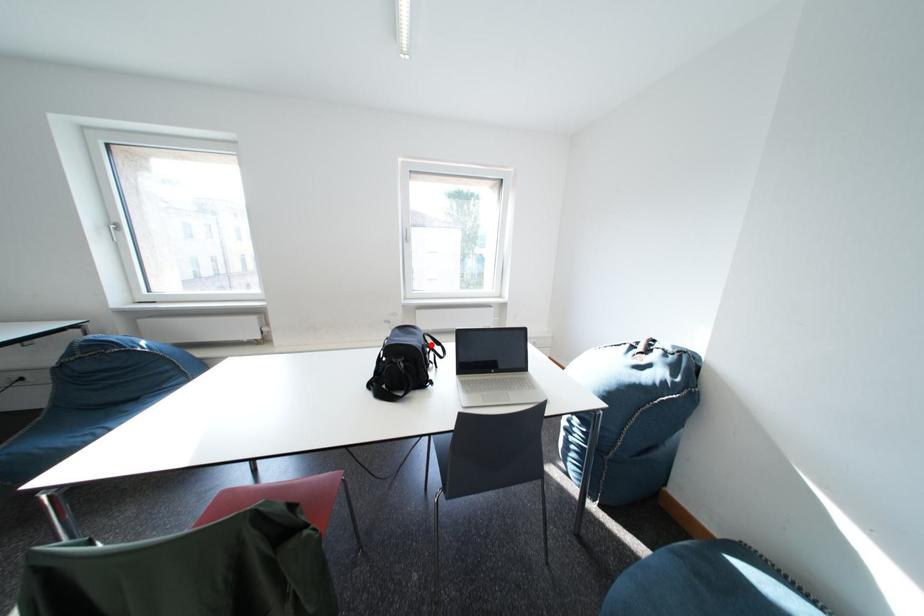
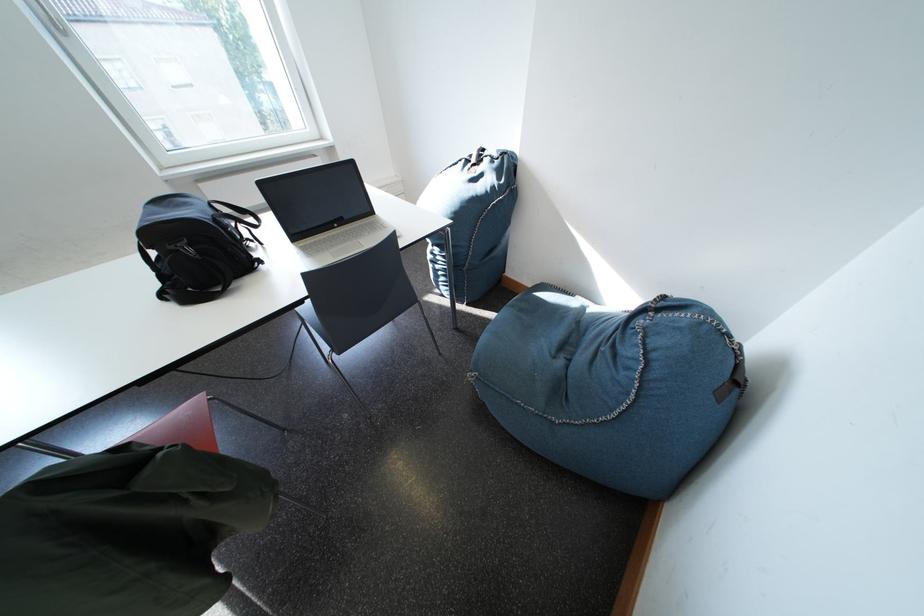
Locate, in the second image, the point that corresponds to the highlighted location in the first image.

(214, 216)